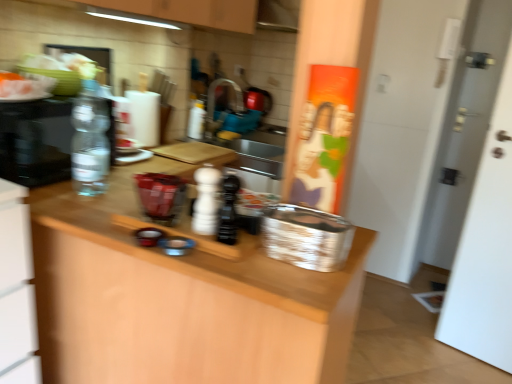
Question: Does transparent plastic bottle at left, which is the 4th bottle from right to left, have a greater width compared to white matte pepper shaker at center, arranged as the 2th bottle when viewed from the front?

Choices:
 (A) no
 (B) yes

Answer: (B)

Question: Is transparent plastic bottle at left, which ranks as the 1th bottle in left-to-right order, oriented away from white matte pepper shaker at center, arranged as the 2th bottle when viewed from the front?

Choices:
 (A) no
 (B) yes

Answer: (A)

Question: From the image's perspective, is transparent plastic bottle at left, which is the 4th bottle from right to left, located above white matte pepper shaker at center, arranged as the 3th bottle when viewed from the left?

Choices:
 (A) no
 (B) yes

Answer: (B)

Question: Is white matte pepper shaker at center, arranged as the 3th bottle when viewed from the left, a part of transparent plastic bottle at left, which is the 2th bottle from back to front?

Choices:
 (A) no
 (B) yes

Answer: (A)

Question: From a real-world perspective, is transparent plastic bottle at left, which is the 4th bottle from right to left, on top of white matte pepper shaker at center, placed as the 3th bottle when sorted from back to front?

Choices:
 (A) yes
 (B) no

Answer: (A)

Question: Visually, is clear glass water bottle at left positioned to the left or to the right of white matte pepper shaker at center, arranged as the 3th bottle when viewed from the left?

Choices:
 (A) right
 (B) left

Answer: (B)

Question: In terms of size, does clear glass water bottle at left appear bigger or smaller than white matte pepper shaker at center, arranged as the 3th bottle when viewed from the left?

Choices:
 (A) big
 (B) small

Answer: (A)

Question: From a real-world perspective, is clear glass water bottle at left physically located above or below white matte pepper shaker at center, arranged as the 3th bottle when viewed from the left?

Choices:
 (A) below
 (B) above

Answer: (B)

Question: Is clear glass water bottle at left situated inside white matte pepper shaker at center, the second bottle positioned from the right, or outside?

Choices:
 (A) inside
 (B) outside

Answer: (B)

Question: In terms of width, does black matte salt shaker at center, the first bottle positioned from the front, look wider or thinner when compared to transparent plastic bottle at left, which is the 2th bottle from back to front?

Choices:
 (A) thin
 (B) wide

Answer: (A)

Question: Based on their sizes in the image, would you say black matte salt shaker at center, the first bottle positioned from the front, is bigger or smaller than transparent plastic bottle at left, which ranks as the 1th bottle in left-to-right order?

Choices:
 (A) big
 (B) small

Answer: (B)

Question: Would you say black matte salt shaker at center, the first bottle positioned from the front, is to the left or to the right of transparent plastic bottle at left, which is the 2th bottle from back to front, in the picture?

Choices:
 (A) right
 (B) left

Answer: (A)

Question: From a real-world perspective, is black matte salt shaker at center, which is the 4th bottle in left-to-right order, physically located above or below transparent plastic bottle at left, acting as the third bottle starting from the front?

Choices:
 (A) below
 (B) above

Answer: (A)

Question: Relative to white matte pepper shaker at center, arranged as the 2th bottle when viewed from the front, is silver metallic basket at center in front or behind?

Choices:
 (A) front
 (B) behind

Answer: (A)

Question: In terms of width, does silver metallic basket at center look wider or thinner when compared to white matte pepper shaker at center, the second bottle positioned from the right?

Choices:
 (A) thin
 (B) wide

Answer: (B)